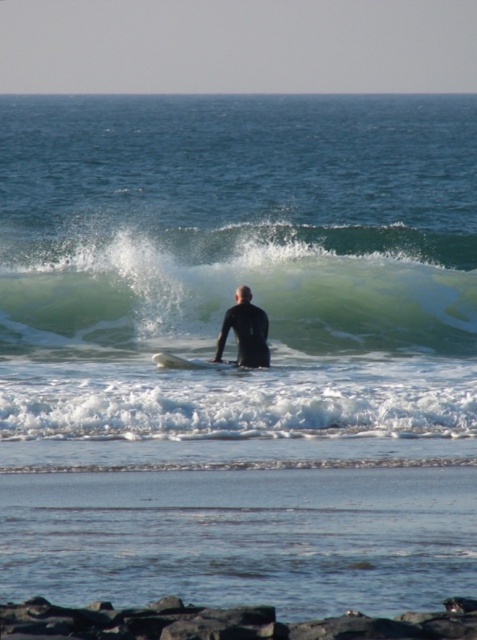
Question: Among these points, which one is nearest to the camera?

Choices:
 (A) [24, 228]
 (B) [215, 362]

Answer: (B)

Question: Which object is positioned closest to the black rubber surfboard at center?

Choices:
 (A) black matte wetsuit at center
 (B) green rubber wave at center

Answer: (A)

Question: Does green rubber wave at center have a lesser width compared to black matte wetsuit at center?

Choices:
 (A) no
 (B) yes

Answer: (A)

Question: Which of the following is the closest to the observer?

Choices:
 (A) black rubber surfboard at center
 (B) green rubber wave at center
 (C) black matte wetsuit at center

Answer: (A)

Question: Where is black matte wetsuit at center located in relation to black rubber surfboard at center in the image?

Choices:
 (A) right
 (B) left

Answer: (A)

Question: Where is green rubber wave at center located in relation to black rubber surfboard at center in the image?

Choices:
 (A) below
 (B) above

Answer: (B)